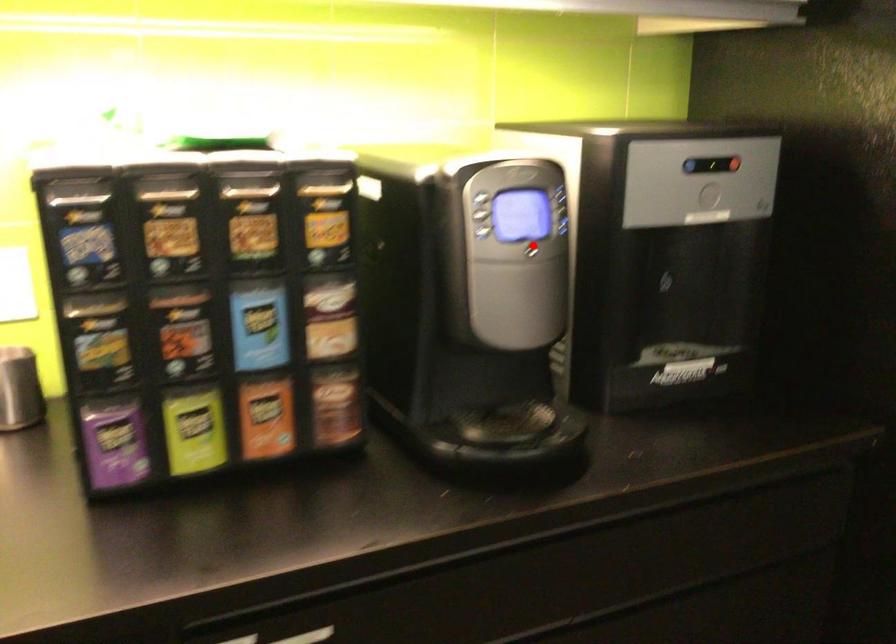
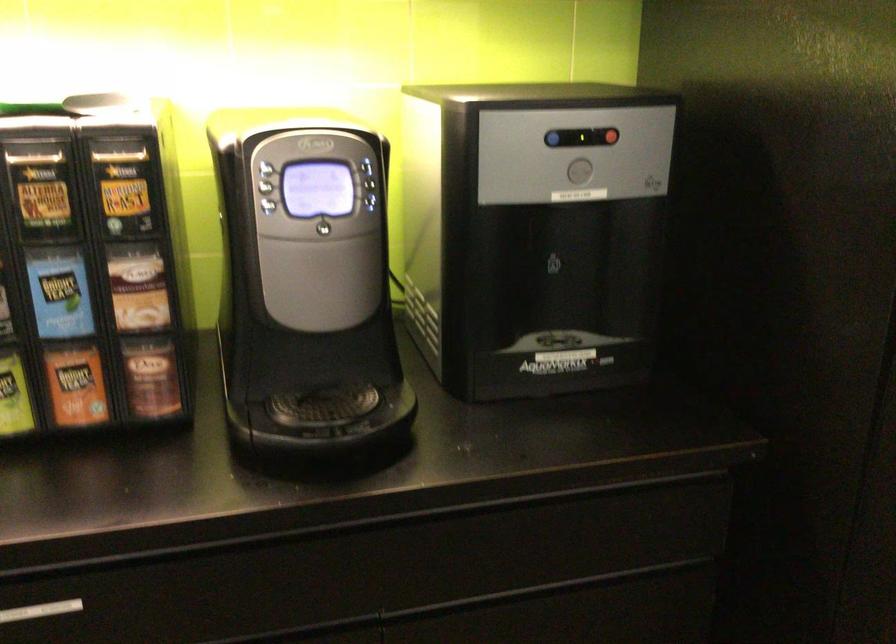
Question: I am providing you with two images of the same scene from different viewpoints. A red point is marked on the first image. Is the red point's position out of view in image 2?

Choices:
 (A) Yes
 (B) No

Answer: (B)